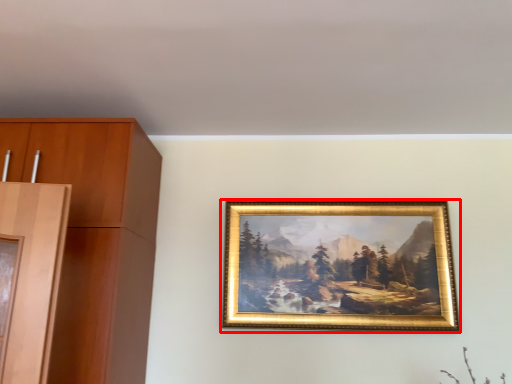
Question: From the image's perspective, where is picture frame (annotated by the red box) located relative to cabinetry?

Choices:
 (A) below
 (B) above

Answer: (A)